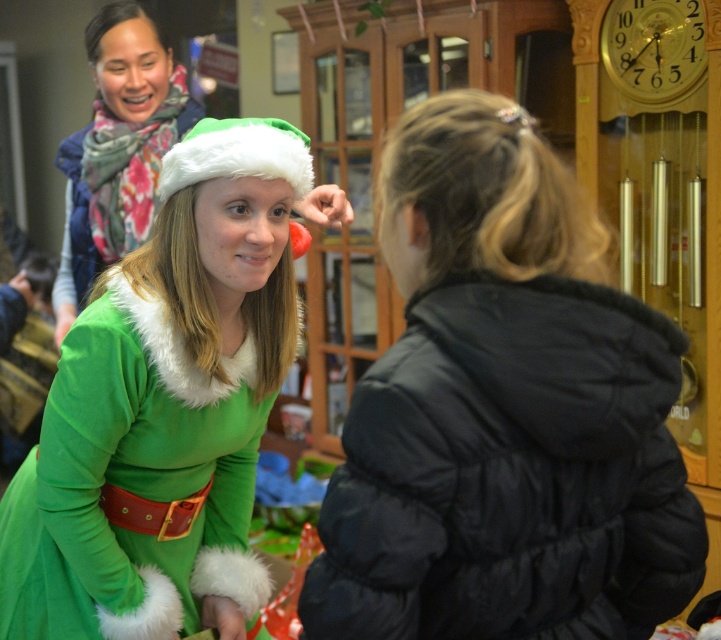
You are a photographer standing in front of the green felt santa outfit at center. You want to take a closeup shot without moving any objects. Can you lean forward to get closer to the outfit?

The green felt santa outfit at center is 1.44 meters from viewer, so yes, you can lean forward to get closer to the outfit as it is within a reachable distance.

You are standing at the point with coordinates point (287, 131). You want to move to the point with coordinates point (198, 609). Is there any obstacle between you and your destination?

Point (198, 609) is behind point (287, 131), so there is an obstacle between you and your destination.